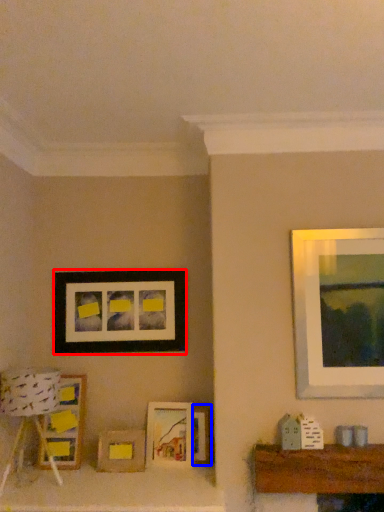
Question: Which object is further to the camera taking this photo, picture frame (highlighted by a red box) or picture frame (highlighted by a blue box)?

Choices:
 (A) picture frame
 (B) picture frame

Answer: (A)